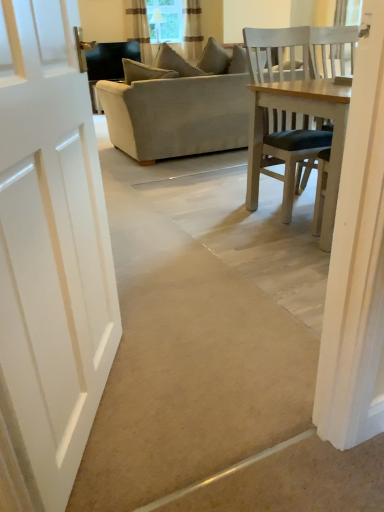
Question: From the image's perspective, is clear glass window screen at upper center beneath brown textured curtain at upper center, which ranks as the 1th curtain in left-to-right order?

Choices:
 (A) no
 (B) yes

Answer: (A)

Question: Is clear glass window screen at upper center far away from brown textured curtain at upper center, which ranks as the 1th curtain in left-to-right order?

Choices:
 (A) yes
 (B) no

Answer: (B)

Question: Can you confirm if clear glass window screen at upper center is wider than brown textured curtain at upper center, which ranks as the 1th curtain in left-to-right order?

Choices:
 (A) yes
 (B) no

Answer: (B)

Question: Considering the relative sizes of clear glass window screen at upper center and brown textured curtain at upper center, which ranks as the 1th curtain in left-to-right order, in the image provided, is clear glass window screen at upper center shorter than brown textured curtain at upper center, which ranks as the 1th curtain in left-to-right order,?

Choices:
 (A) no
 (B) yes

Answer: (B)

Question: Is clear glass window screen at upper center thinner than brown textured curtain at upper center, which ranks as the 1th curtain in left-to-right order?

Choices:
 (A) no
 (B) yes

Answer: (B)

Question: Is clear glass window screen at upper center to the left of brown textured curtain at upper center, which ranks as the 1th curtain in left-to-right order, from the viewer's perspective?

Choices:
 (A) no
 (B) yes

Answer: (A)

Question: Is striped fabric curtain at upper center, which ranks as the second curtain in left-to-right order, completely or partially inside beige fabric couch at center?

Choices:
 (A) yes
 (B) no

Answer: (B)

Question: Can you confirm if beige fabric couch at center is smaller than striped fabric curtain at upper center, arranged as the 1th curtain when viewed from the right?

Choices:
 (A) no
 (B) yes

Answer: (A)

Question: Is beige fabric couch at center looking in the opposite direction of striped fabric curtain at upper center, which ranks as the second curtain in left-to-right order?

Choices:
 (A) no
 (B) yes

Answer: (A)

Question: Would you consider beige fabric couch at center to be distant from striped fabric curtain at upper center, arranged as the 1th curtain when viewed from the right?

Choices:
 (A) yes
 (B) no

Answer: (A)

Question: Is beige fabric couch at center taller than striped fabric curtain at upper center, arranged as the 1th curtain when viewed from the right?

Choices:
 (A) no
 (B) yes

Answer: (B)

Question: Is beige fabric couch at center shorter than striped fabric curtain at upper center, which ranks as the second curtain in left-to-right order?

Choices:
 (A) yes
 (B) no

Answer: (B)

Question: Does clear glass window screen at upper center have a lesser width compared to beige fabric couch at center?

Choices:
 (A) no
 (B) yes

Answer: (B)